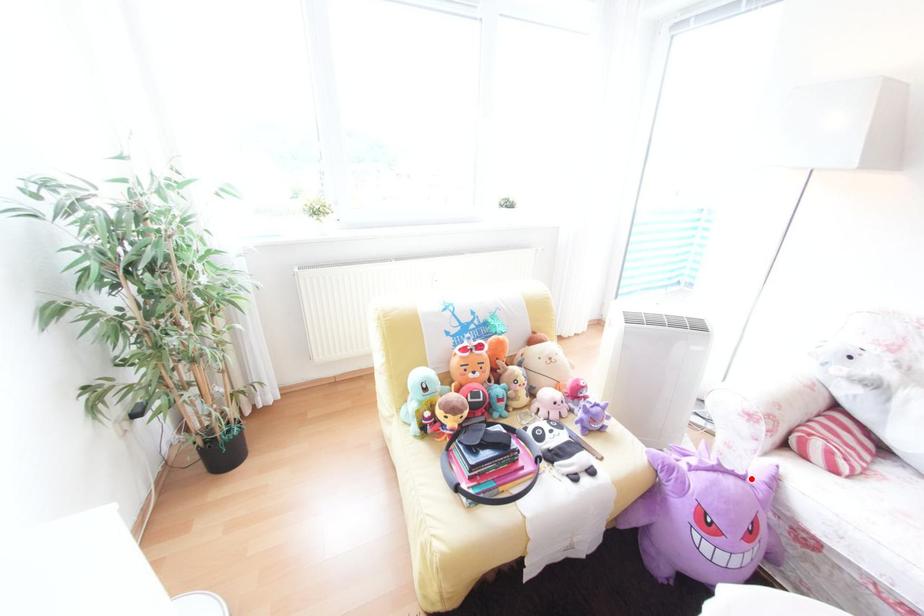
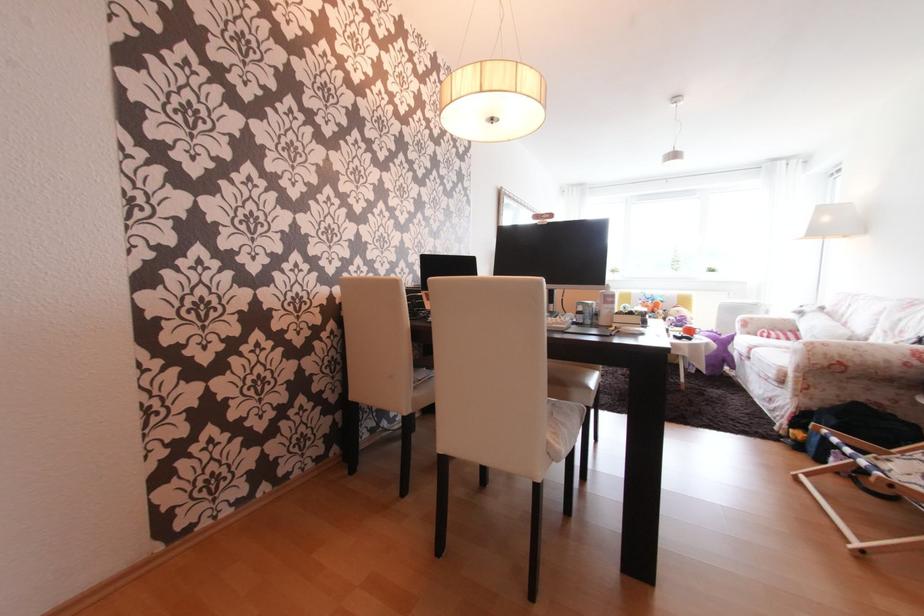
The point at the highlighted location is marked in the first image. Where is the corresponding point in the second image?

(727, 336)